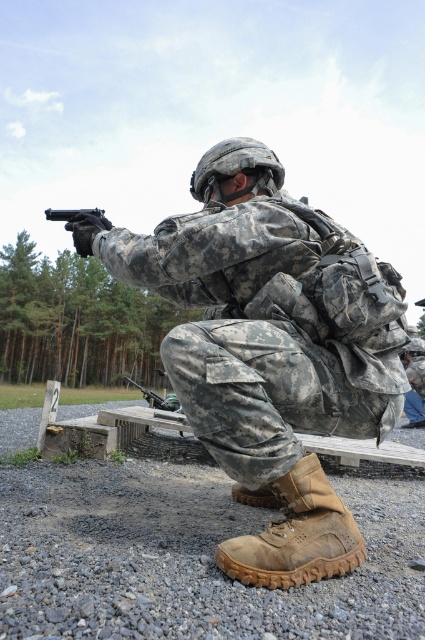
You are a photographer trying to capture the soldier in the image. You need to ensure that both the brown rugged boot at lower center and the matte black handgun at upper center are clearly visible in your shot. Given their sizes, which object should you focus on first to ensure it is in sharp focus?

The brown rugged boot at lower center has a smaller size compared to the matte black handgun at upper center. Since smaller objects require more precise focusing, you should focus on the brown rugged boot at lower center first to ensure clarity.

You are a photographer trying to capture a closeup shot of the brown rugged boot at lower center and the matte black shotgun at lower center. Since your camera can only focus on one object at a time, which object should you choose to ensure it appears in focus if you want the thicker object to be sharp?

The matte black shotgun at lower center is thicker than the brown rugged boot at lower center, so you should focus on the matte black shotgun at lower center to ensure the thicker object is sharp.

You are a photographer taking a picture of the soldier in the forest. You have two points marked in the image for focus adjustments. The first point is at coordinate point (260, 148) and the second point is at coordinate point (158, 401). Which point should you focus on if you want the soldier to be in sharp focus?

Point (260, 148) is closer to the viewer than point (158, 401). Therefore, focusing on point (260, 148) will ensure the soldier is in sharp focus.